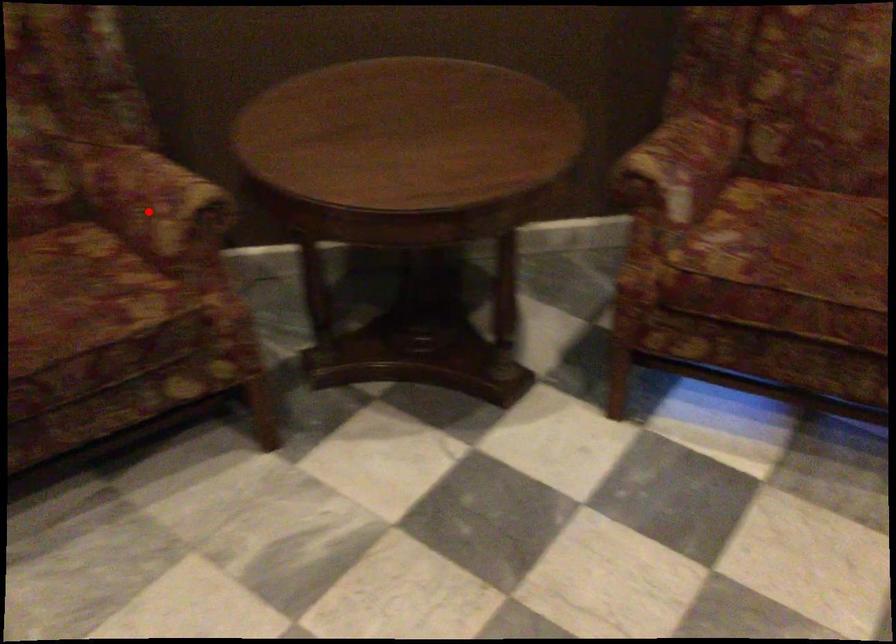
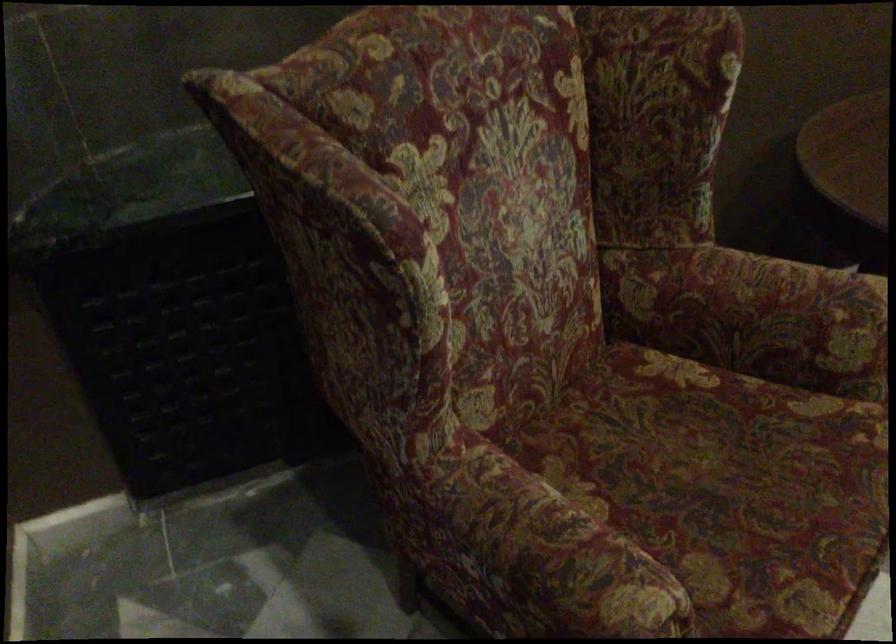
Question: I am providing you with two images of the same scene from different viewpoints. Given a red point in image1, look at the same physical point in image2. Is it:

Choices:
 (A) Closer to the viewpoint
 (B) Farther from the viewpoint

Answer: (A)